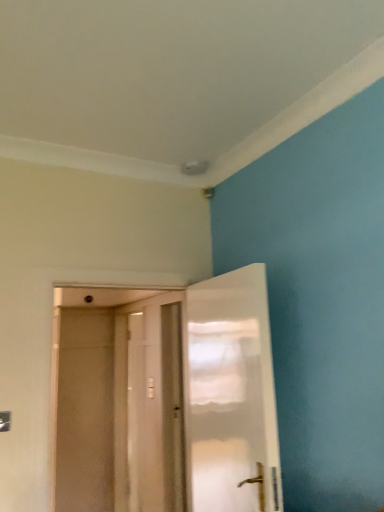
Question: Considering the positions of transparent plastic screen door at center and white glossy door at center, which is the 2th door in front-to-back order, in the image, is transparent plastic screen door at center bigger or smaller than white glossy door at center, which is the 2th door in front-to-back order,?

Choices:
 (A) small
 (B) big

Answer: (A)

Question: Considering the positions of point (74, 439) and point (130, 468), is point (74, 439) closer or farther from the camera than point (130, 468)?

Choices:
 (A) farther
 (B) closer

Answer: (A)

Question: Which of these objects is positioned closest to the white matte door at center, the second door positioned from the back?

Choices:
 (A) white glossy door at center, which is the 2th door in front-to-back order
 (B) transparent plastic screen door at center

Answer: (B)

Question: Estimate the real-world distances between objects in this image. Which object is farther from the transparent plastic screen door at center?

Choices:
 (A) white matte door at center, acting as the 1th door starting from the front
 (B) white glossy door at center, which is counted as the 1th door, starting from the back

Answer: (B)